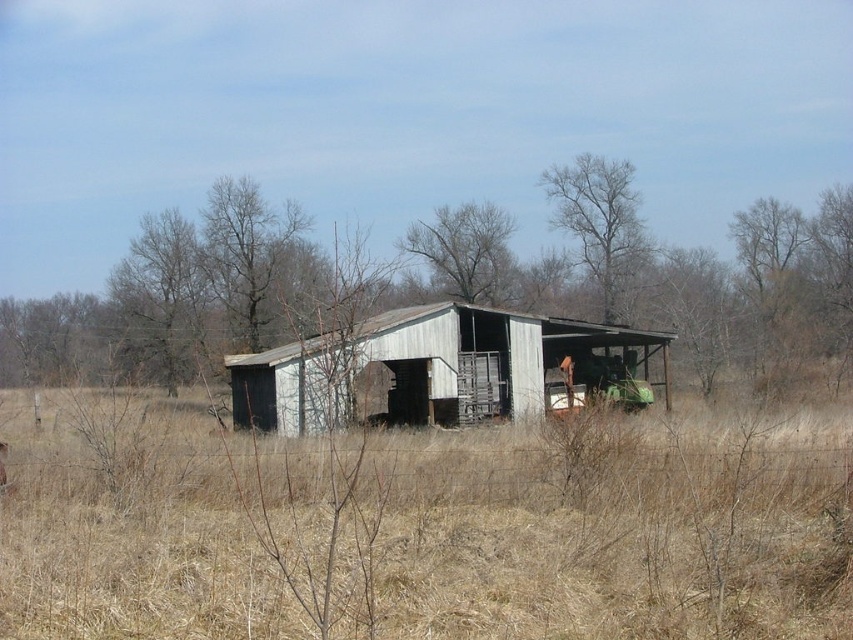
This screenshot has width=853, height=640. Identify the location of brown dry grass at center. (424, 525).

Is point (837, 579) positioned behind point (250, 356)?

No, (837, 579) is closer to viewer.

You are a GUI agent. You are given a task and a screenshot of the screen. Output one action in this format:
    pyautogui.click(x=<x>, y=<y>)
    Task: Click on the brown dry grass at center
    
    Given the screenshot: What is the action you would take?
    pyautogui.click(x=424, y=525)